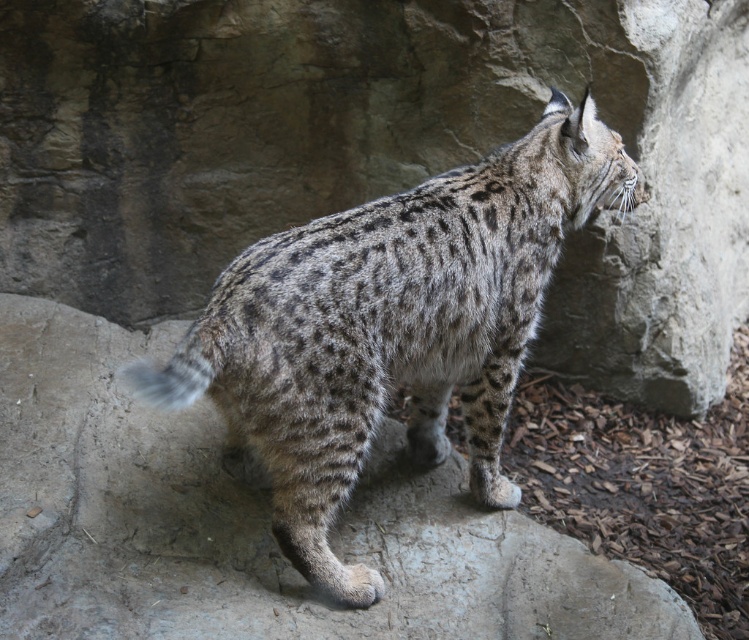
Question: Is the position of gray textured rock at center less distant than that of spotted fur cat at center?

Choices:
 (A) no
 (B) yes

Answer: (A)

Question: Which of the following is the closest to the observer?

Choices:
 (A) (24, 513)
 (B) (449, 364)

Answer: (A)

Question: Does gray textured rock at center have a smaller size compared to spotted fur cat at center?

Choices:
 (A) no
 (B) yes

Answer: (A)

Question: Where is gray textured rock at center located in relation to spotted fur cat at center in the image?

Choices:
 (A) right
 (B) left

Answer: (B)